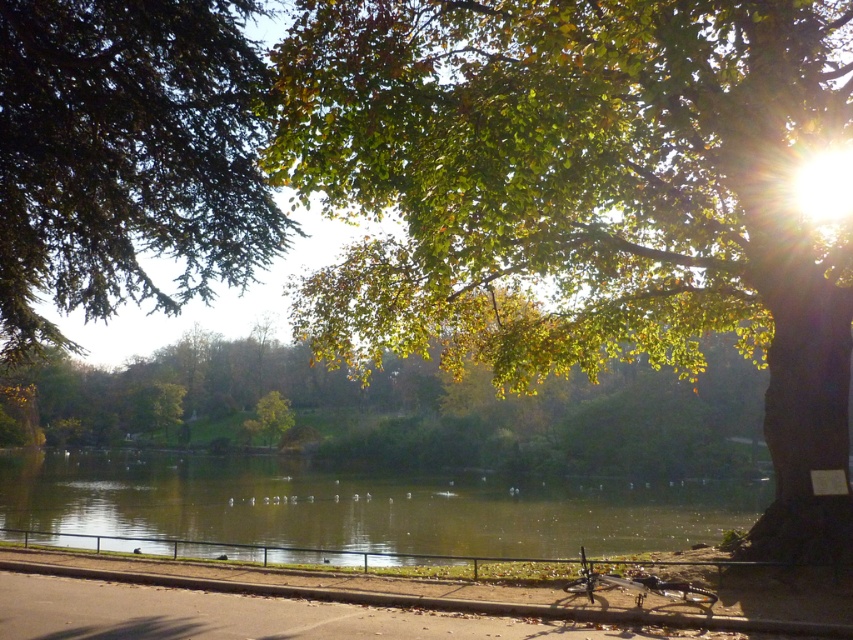
Is green leafy tree at upper right to the left of shiny metallic bicycle at lower center from the viewer's perspective?

Yes, green leafy tree at upper right is to the left of shiny metallic bicycle at lower center.

Who is positioned more to the right, green leafy tree at upper right or shiny metallic bicycle at lower center?

shiny metallic bicycle at lower center is more to the right.

Find the location of a particular element. The image size is (853, 640). green leafy tree at upper right is located at coordinates (585, 200).

Find the location of a particular element. The image size is (853, 640). green leafy tree at upper right is located at coordinates (585, 200).

Is point (583, 593) farther from camera compared to point (259, 428)?

No, it is in front of (259, 428).

Between shiny metallic bicycle at lower center and green leafy tree at center, which one has more height?

green leafy tree at center

Where is `shiny metallic bicycle at lower center`? The width and height of the screenshot is (853, 640). shiny metallic bicycle at lower center is located at coordinates (636, 584).

Which is below, green leafy tree at upper right or green leafy tree at center?

green leafy tree at center

Which is more to the right, green leafy tree at upper right or green leafy tree at center?

From the viewer's perspective, green leafy tree at upper right appears more on the right side.

Locate an element on the screen. green leafy tree at upper right is located at coordinates pos(585,200).

Locate an element on the screen. The height and width of the screenshot is (640, 853). green leafy tree at upper right is located at coordinates (585, 200).